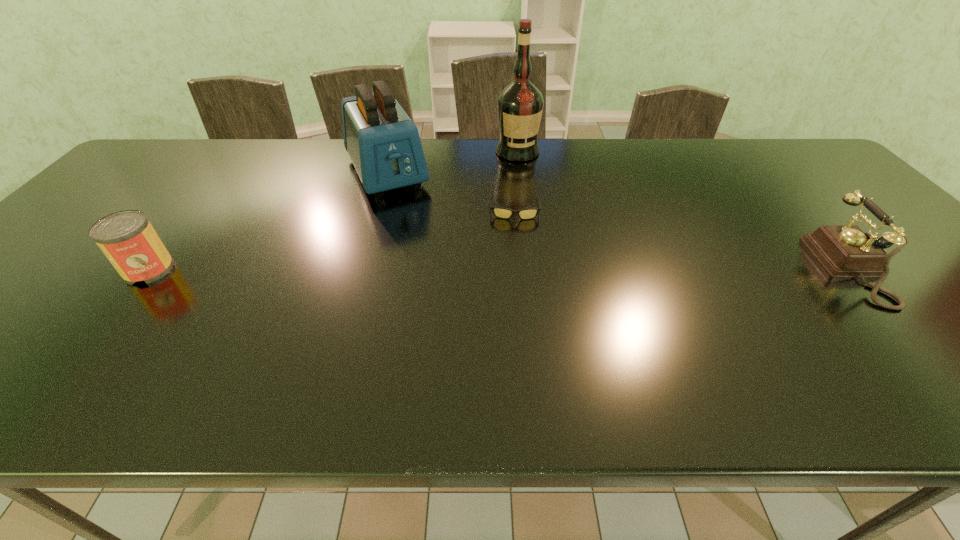
This screenshot has width=960, height=540. Identify the location of vacant region at the far edge. tap(267, 154).

At what (x,y) coordinates should I click in order to perform the action: click on free space at the near edge of the desktop. Please return your answer as a coordinate pair (x, y). The width and height of the screenshot is (960, 540). Looking at the image, I should click on (633, 335).

Find the location of `vacant space at the left edge`. vacant space at the left edge is located at coordinates (25, 313).

Where is `free point at the right edge`? This screenshot has width=960, height=540. free point at the right edge is located at coordinates (948, 298).

The width and height of the screenshot is (960, 540). What are the coordinates of `vacant region at the far right corner of the desktop` in the screenshot? It's located at (782, 153).

Image resolution: width=960 pixels, height=540 pixels. I want to click on free space between the liquor and the telephone, so click(x=688, y=211).

Where is `free space between the shortest object and the tallest object`? Image resolution: width=960 pixels, height=540 pixels. free space between the shortest object and the tallest object is located at coordinates (516, 178).

I want to click on blank region between the liquor and the shortest object, so [x=516, y=178].

I want to click on free spot between the tallest object and the fourth object from right to left, so click(x=452, y=161).

You are a GUI agent. You are given a task and a screenshot of the screen. Output one action in this format:
    pyautogui.click(x=<x>, y=<y>)
    Task: Click on the vacant area that lies between the leftmost object and the shortest object
    
    Given the screenshot: What is the action you would take?
    pyautogui.click(x=332, y=237)